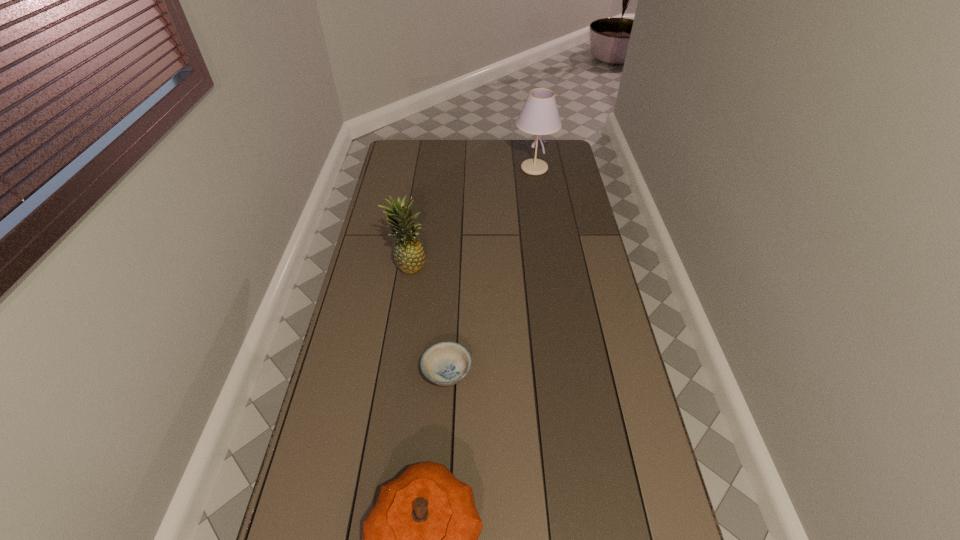
At what (x,y) coordinates should I click in order to perform the action: click on free spot between the pineapple and the shortest object. Please return your answer as a coordinate pair (x, y). The height and width of the screenshot is (540, 960). Looking at the image, I should click on (428, 319).

Image resolution: width=960 pixels, height=540 pixels. In order to click on free spot between the second tallest object and the tallest object in this screenshot , I will do `click(471, 217)`.

Where is `empty space that is in between the third shortest object and the bowl`? empty space that is in between the third shortest object and the bowl is located at coordinates (428, 319).

Where is `object that can be found as the closest to the pumpkin`? This screenshot has width=960, height=540. object that can be found as the closest to the pumpkin is located at coordinates (447, 363).

Select which object appears as the third closest to the third farthest object. Please provide its 2D coordinates. Your answer should be formatted as a tuple, i.e. [(x, y)], where the tuple contains the x and y coordinates of a point satisfying the conditions above.

[(539, 116)]